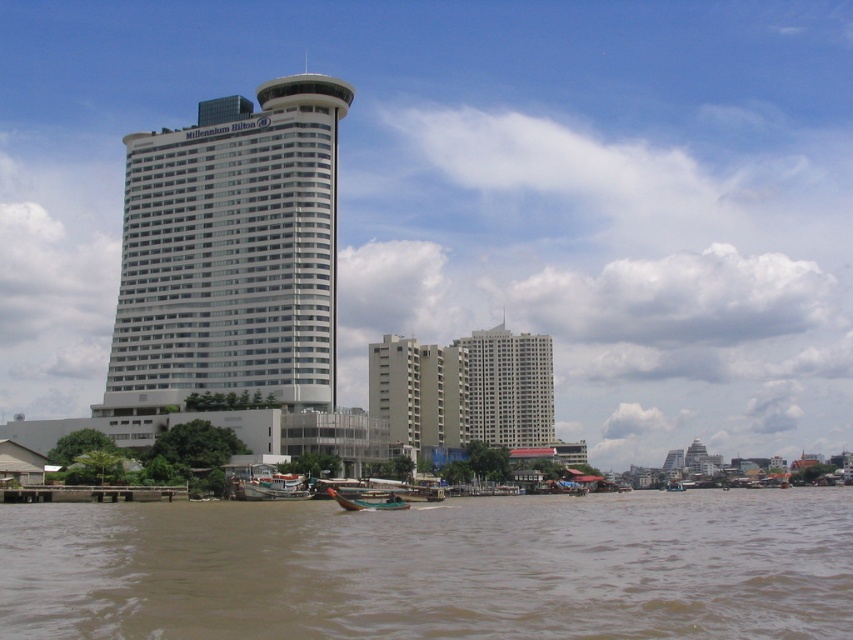
You are standing at the Millennium Hilton waterfront and want to locate two specific points marked on a map. The first point is at coordinate point (746,536) and the second is at point (283,490). Which of these two points is closer to you from your current position at the waterfront?

Point (746,536) is in front of point (283,490), so it is closer to your current position at the waterfront.

You are an architect reviewing the Millennium Hilton design. The building has two distinct sections. Which section, the white glass building at center or the white smooth building at center, is positioned higher up in the structure?

The white glass building at center is positioned higher up in the structure as it is located above the white smooth building at center.